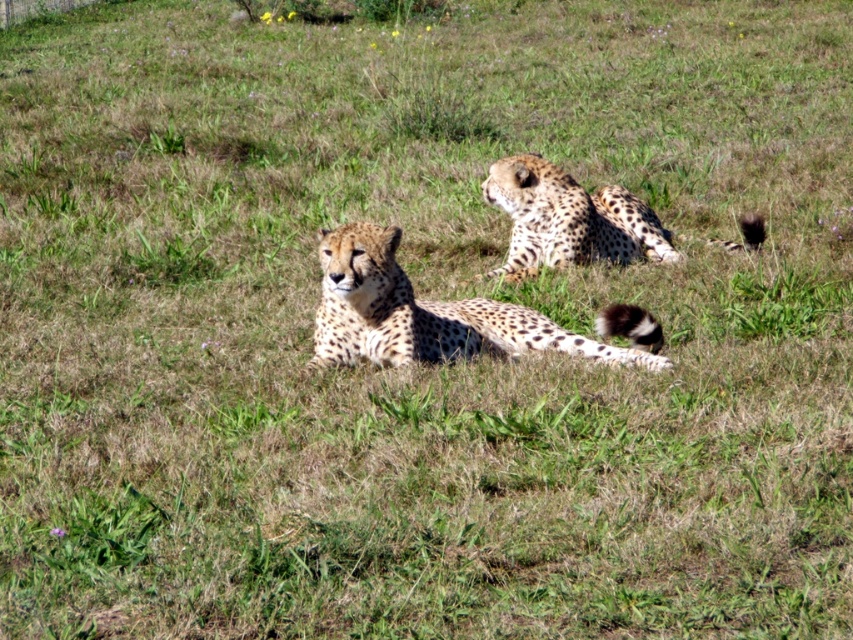
You are a wildlife photographer trying to capture a closeup of the spotted fur cheetah at center and the spotted fur cheetah at upper right. Given that your camera can only focus on one subject at a time, which cheetah should you choose to ensure the best focus if you want the largest subject in the frame?

The spotted fur cheetah at center is bigger than the spotted fur cheetah at upper right, so you should choose to focus on the spotted fur cheetah at center to get the largest subject in the frame.

You are a wildlife photographer aiming to capture a closeup shot of the cheetahs. Which cheetah, the spotted fur cheetah at center or the spotted fur cheetah at upper right, would be easier to photograph clearly without needing a telephoto lens?

The spotted fur cheetah at center is closer to the viewer than the spotted fur cheetah at upper right, so it would be easier to photograph clearly without needing a telephoto lens.

You are a wildlife photographer aiming to capture a closeup shot of the spotted fur cheetah at center. You are currently positioned at the point marked as point (424, 314). Can you confirm if you are already at the correct location to take the photo?

Yes, the spotted fur cheetah at center is located at point (424, 314), so you are already at the correct location to take the photo.